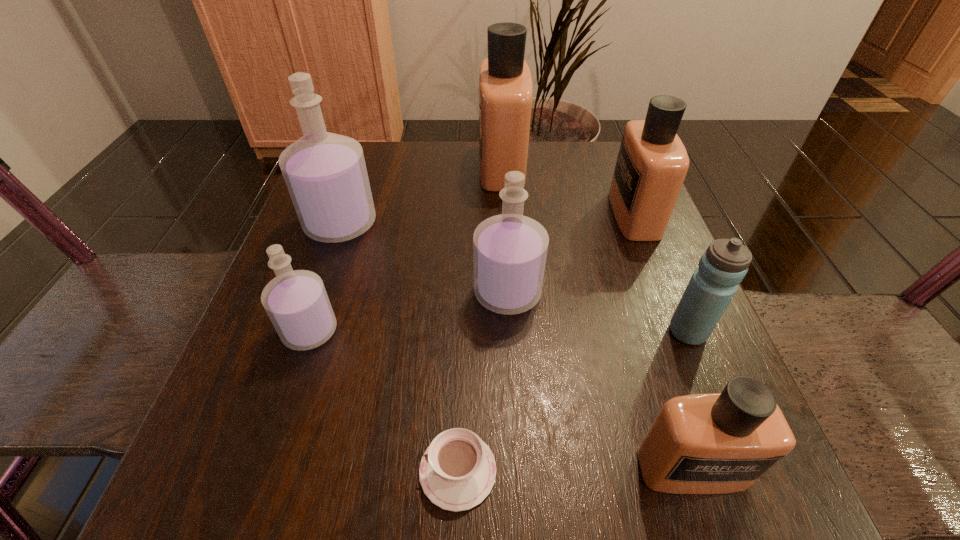
Image resolution: width=960 pixels, height=540 pixels. What are the coordinates of `vacant area located on the handle side of the teacup` in the screenshot? It's located at (190, 471).

Where is `perfume positioned at the near edge`? perfume positioned at the near edge is located at coordinates (720, 443).

This screenshot has width=960, height=540. In order to click on teacup located at the near edge in this screenshot , I will do `click(457, 471)`.

Identify the location of water bottle present at the right edge. The height and width of the screenshot is (540, 960). (724, 264).

Find the location of `object that is at the far right corner`. object that is at the far right corner is located at coordinates (652, 163).

Locate an element on the screen. The width and height of the screenshot is (960, 540). object located in the near right corner section of the desktop is located at coordinates (720, 443).

The width and height of the screenshot is (960, 540). I want to click on free space at the far edge, so click(559, 185).

Where is `vacant area at the left edge of the desktop`? vacant area at the left edge of the desktop is located at coordinates (330, 352).

Where is `free space at the right edge of the desktop`? The width and height of the screenshot is (960, 540). free space at the right edge of the desktop is located at coordinates click(660, 314).

In the image, there is a desktop. Find the location of `free space at the far left corner`. free space at the far left corner is located at coordinates (384, 170).